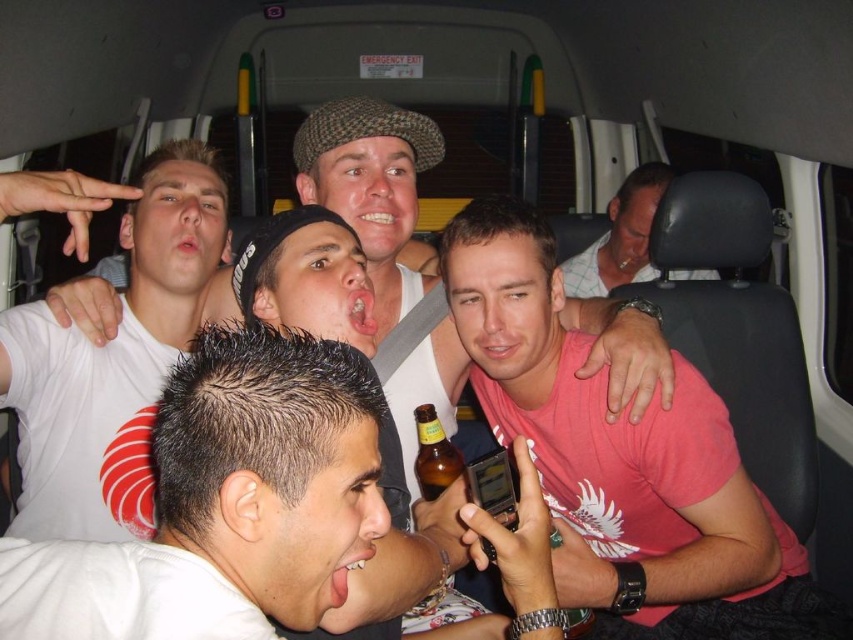
Question: Is white t-shirt at upper left positioned in front of brown glass bottle at center?

Choices:
 (A) yes
 (B) no

Answer: (A)

Question: Among these points, which one is nearest to the camera?

Choices:
 (A) (595, 275)
 (B) (88, 356)
 (C) (421, 408)
 (D) (641, 598)

Answer: (D)

Question: Which point is closer to the camera?

Choices:
 (A) white t-shirt at upper left
 (B) brown glass bottle at center

Answer: (A)

Question: Can you confirm if pink matte shirt at center is positioned to the left of brown glass bottle at center?

Choices:
 (A) yes
 (B) no

Answer: (B)

Question: Can you confirm if pink matte shirt at center is positioned to the right of brown glass bottle at center?

Choices:
 (A) yes
 (B) no

Answer: (A)

Question: Which object is closer to the camera taking this photo?

Choices:
 (A) pink matte shirt at center
 (B) white shirt at center
 (C) white t-shirt at upper left

Answer: (C)